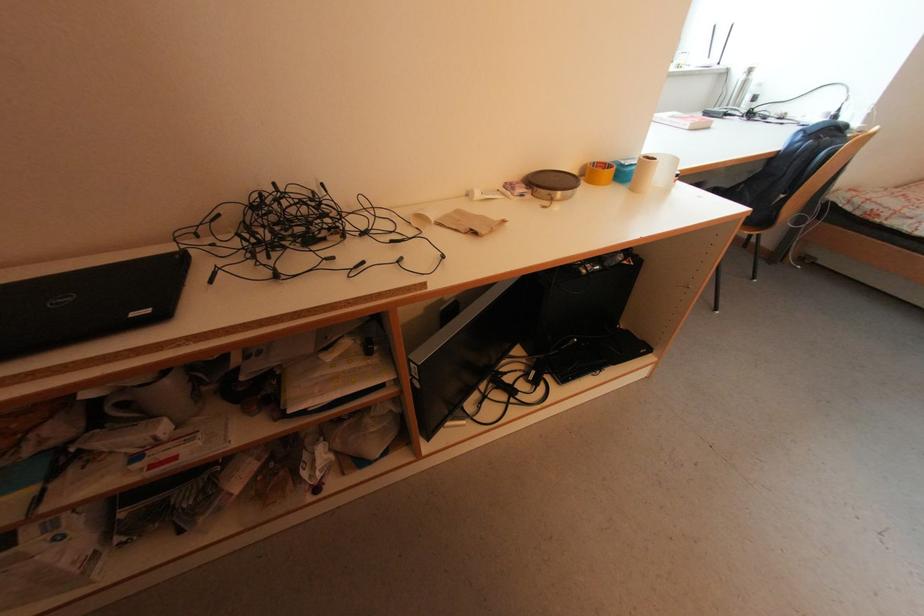
At what (x,y) coordinates should I click in order to perform the action: click on round metal lid. Please return your answer as a coordinate pair (x, y). The image size is (924, 616). Looking at the image, I should click on (552, 184).